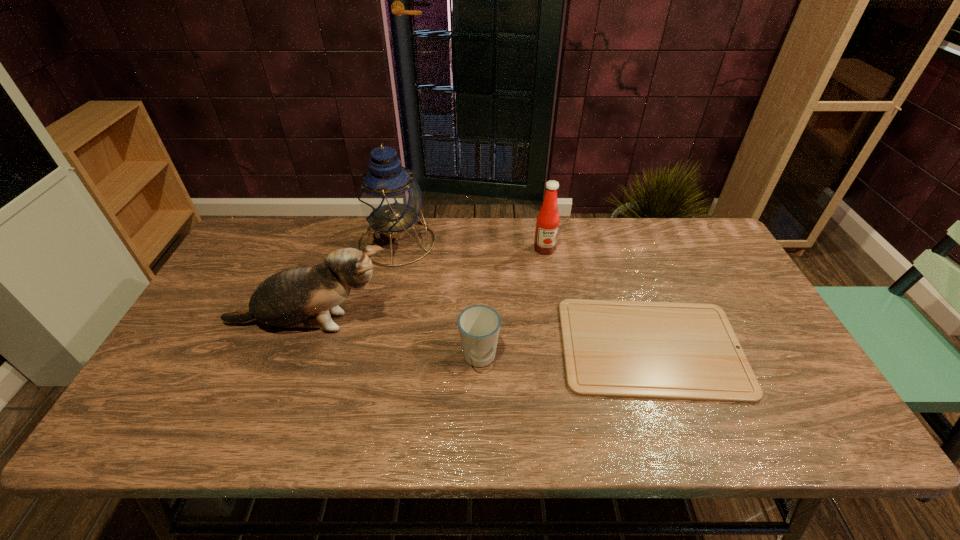
Identify the location of free point between the fourth tallest object and the condiment. The image size is (960, 540). tap(512, 303).

Where is `empty location between the lantern and the shortest object`? empty location between the lantern and the shortest object is located at coordinates (524, 294).

I want to click on vacant area that lies between the condiment and the shortest object, so click(598, 298).

Where is `empty location between the cat and the condiment`? This screenshot has height=540, width=960. empty location between the cat and the condiment is located at coordinates (427, 286).

At what (x,y) coordinates should I click in order to perform the action: click on empty space between the cup and the tallest object. Please return your answer as a coordinate pair (x, y). Looking at the image, I should click on (438, 300).

The image size is (960, 540). I want to click on free point between the condiment and the lantern, so click(x=470, y=245).

The height and width of the screenshot is (540, 960). I want to click on free space between the condiment and the tallest object, so click(470, 245).

In order to click on vacant space in between the condiment and the shortest object in this screenshot , I will do `click(598, 298)`.

Select which object is the closest to the cat. Please provide its 2D coordinates. Your answer should be formatted as a tuple, i.e. [(x, y)], where the tuple contains the x and y coordinates of a point satisfying the conditions above.

[(389, 198)]

This screenshot has width=960, height=540. What are the coordinates of `object that is the second closest one to the shortest object` in the screenshot? It's located at (547, 225).